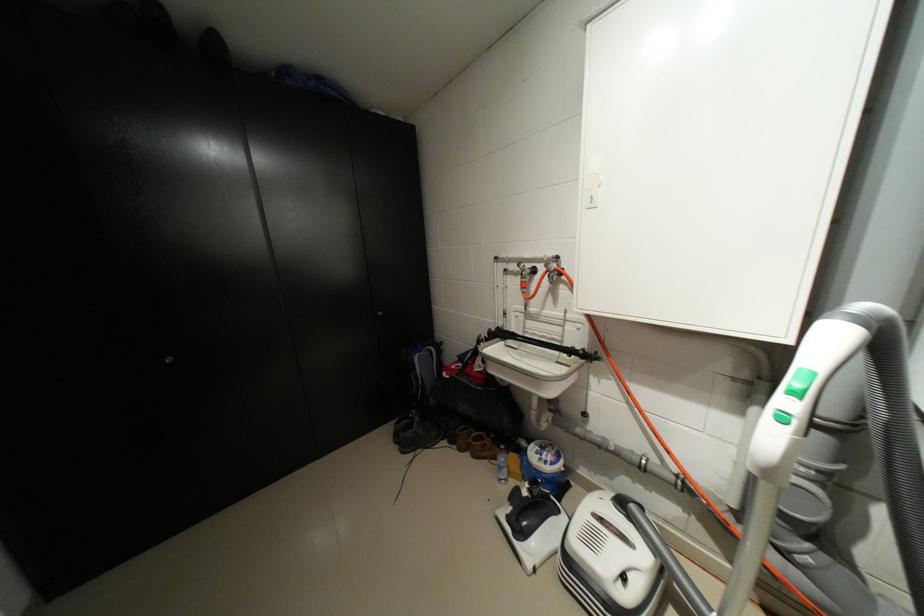
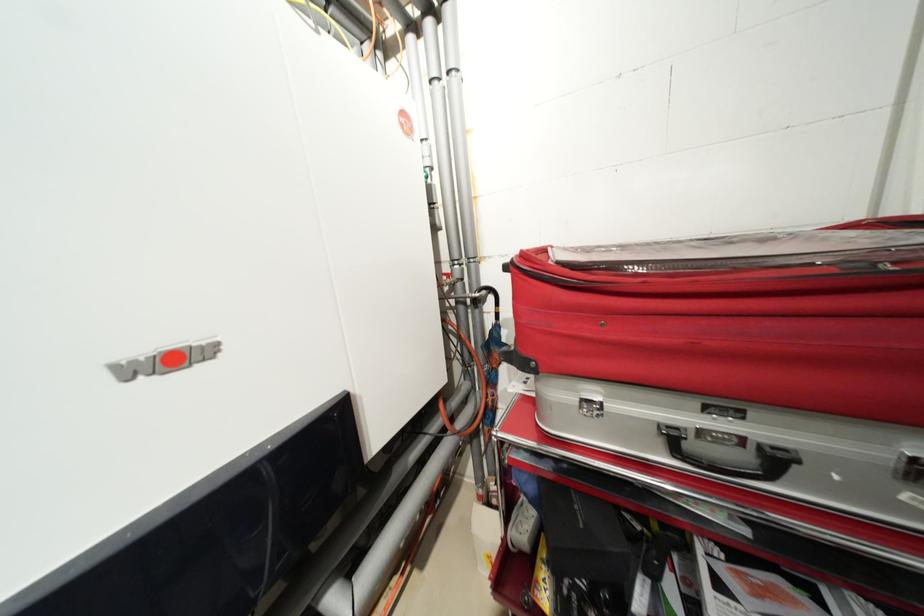
Question: The camera is either moving clockwise (left) or counter-clockwise (right) around the object. The first image is from the beginning of the video and the second image is from the end. Is the camera moving left or right when shooting the video?

Choices:
 (A) Left
 (B) Right

Answer: (A)